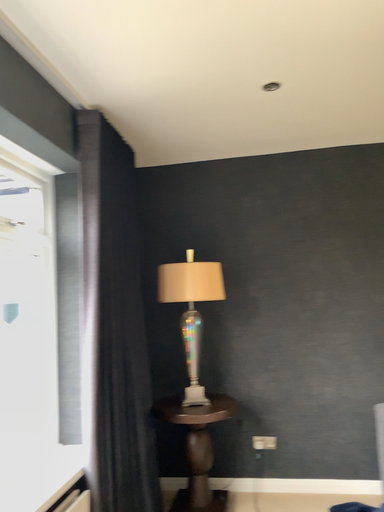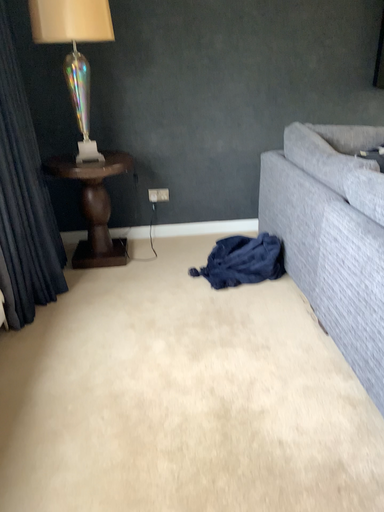
Question: Which way did the camera rotate in the video?

Choices:
 (A) rotated right
 (B) rotated left

Answer: (A)